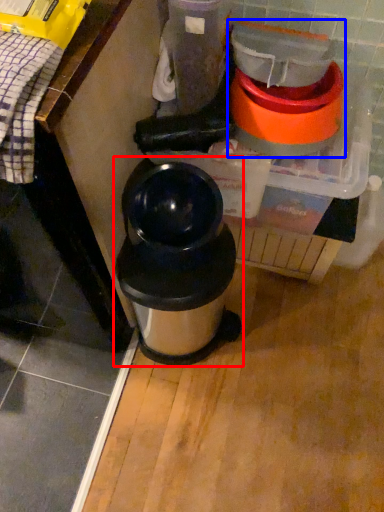
Question: Which object is closer to the camera taking this photo, waste container (highlighted by a red box) or blender (highlighted by a blue box)?

Choices:
 (A) waste container
 (B) blender

Answer: (B)